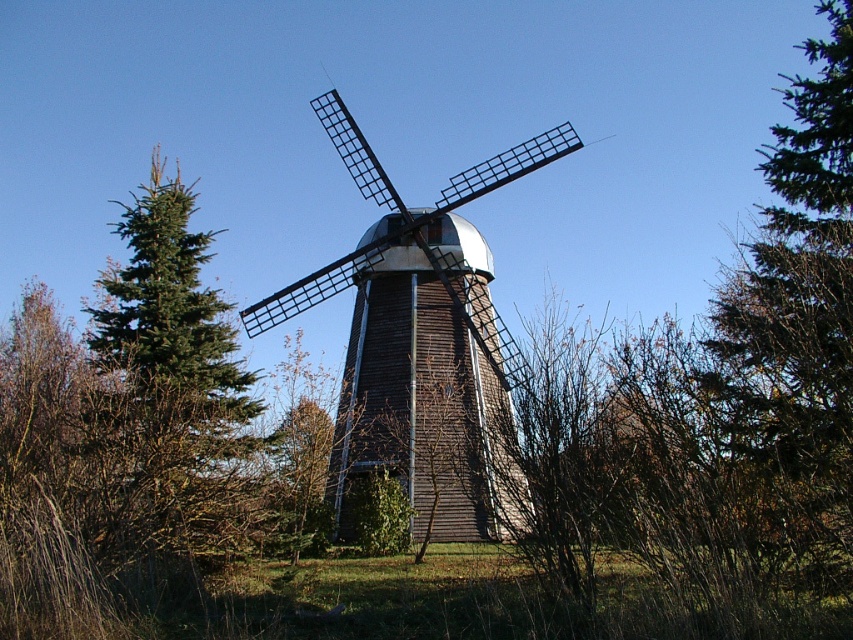
Between point (428, 496) and point (178, 340), which one is positioned behind?

The point (428, 496) is more distant.

Does brown wooden windmill at center come behind green needle-like tree at left?

No, it is not.

Is point (415, 323) positioned before point (132, 358)?

That is False.

Image resolution: width=853 pixels, height=640 pixels. Identify the location of brown wooden windmill at center. (422, 344).

Does green grass at center have a larger size compared to green needle-like tree at left?

Incorrect, green grass at center is not larger than green needle-like tree at left.

Is green grass at center further to the viewer compared to green needle-like tree at left?

No, it is in front of green needle-like tree at left.

Image resolution: width=853 pixels, height=640 pixels. What do you see at coordinates (375, 598) in the screenshot? I see `green grass at center` at bounding box center [375, 598].

Identify the location of green grass at center. coord(375,598).

Is point (432, 401) closer to camera compared to point (122, 624)?

No.

Is point (518, 148) positioned after point (520, 621)?

Yes.

Where is `brown wooden windmill at center`? The width and height of the screenshot is (853, 640). brown wooden windmill at center is located at coordinates (422, 344).